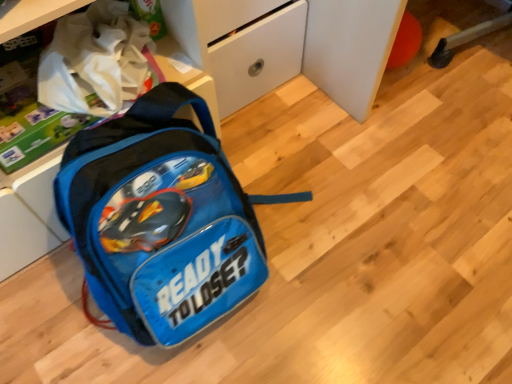
Question: Considering the relative sizes of white matte drawer at center and blue fabric backpack at center in the image provided, is white matte drawer at center thinner than blue fabric backpack at center?

Choices:
 (A) no
 (B) yes

Answer: (B)

Question: Is white matte drawer at center facing away from blue fabric backpack at center?

Choices:
 (A) no
 (B) yes

Answer: (A)

Question: From a real-world perspective, is white matte drawer at center beneath blue fabric backpack at center?

Choices:
 (A) yes
 (B) no

Answer: (B)

Question: Can you confirm if white matte drawer at center is positioned to the left of blue fabric backpack at center?

Choices:
 (A) no
 (B) yes

Answer: (A)

Question: Is white matte drawer at center positioned far away from blue fabric backpack at center?

Choices:
 (A) yes
 (B) no

Answer: (B)

Question: Considering the relative sizes of white matte drawer at center and blue fabric backpack at center in the image provided, is white matte drawer at center taller than blue fabric backpack at center?

Choices:
 (A) yes
 (B) no

Answer: (A)

Question: Is blue fabric backpack at center taller than white matte drawer at center?

Choices:
 (A) yes
 (B) no

Answer: (B)

Question: Is there a large distance between blue fabric backpack at center and white matte drawer at center?

Choices:
 (A) no
 (B) yes

Answer: (A)

Question: Is blue fabric backpack at center positioned with its back to white matte drawer at center?

Choices:
 (A) no
 (B) yes

Answer: (A)

Question: Can you confirm if blue fabric backpack at center is thinner than white matte drawer at center?

Choices:
 (A) yes
 (B) no

Answer: (B)

Question: Is the position of blue fabric backpack at center more distant than that of white matte drawer at center?

Choices:
 (A) no
 (B) yes

Answer: (A)

Question: From a real-world perspective, is blue fabric backpack at center located beneath white matte drawer at center?

Choices:
 (A) yes
 (B) no

Answer: (A)

Question: From a real-world perspective, relative to white matte drawer at center, is blue fabric backpack at center vertically above or below?

Choices:
 (A) above
 (B) below

Answer: (B)